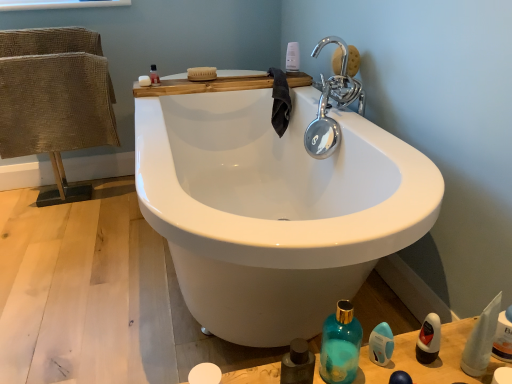
Find the location of a particular element. This screenshot has height=384, width=512. free region on the left part of black plastic bottle at lower right, which is the first mouthwash from right to left is located at coordinates (382, 362).